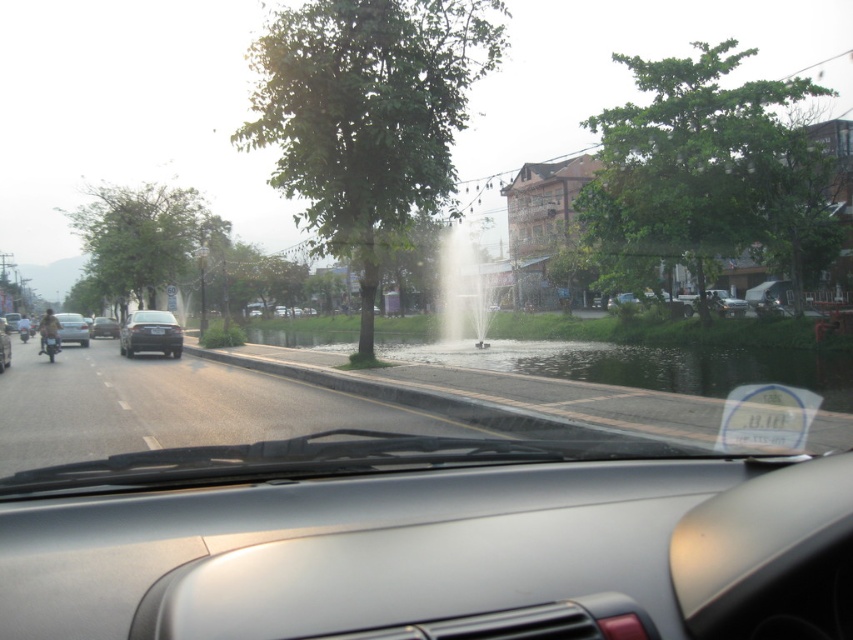
You are driving a car and see the metallic silver motorcycle at left and the black plastic license plate at center ahead on the road. Which object is closer to the left side of the road?

The metallic silver motorcycle at left is closer to the left side of the road because it is positioned to the left of the black plastic license plate at center.

You are driving a car and see the point marked as point (49, 342) on the road ahead. What object is located at that point?

The point (49, 342) is where the metallic silver motorcycle at left is located.

You are driving a car and see the black matte car at center and the satin black sedan at left. Which one is closer to you?

The black matte car at center is closer to you because it is in front of the satin black sedan at left.